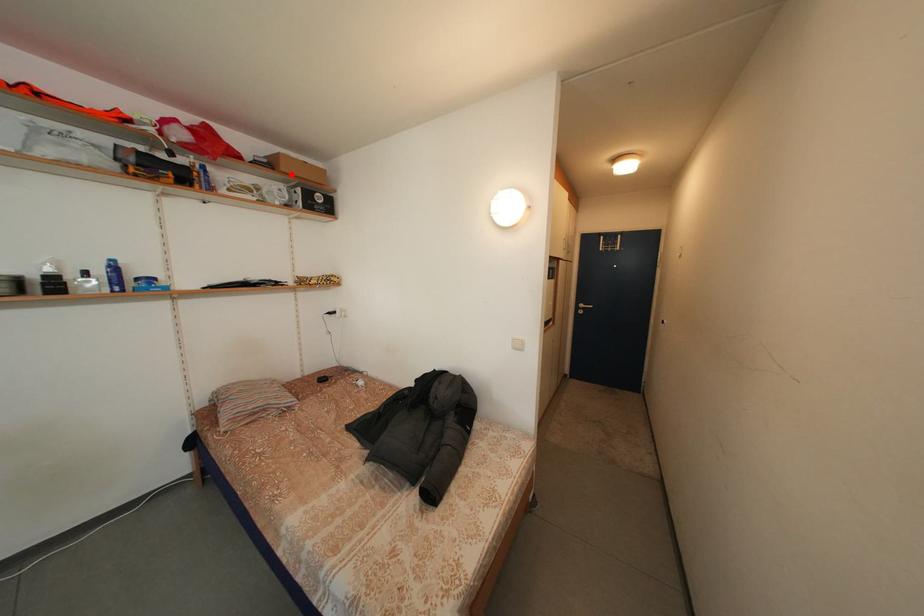
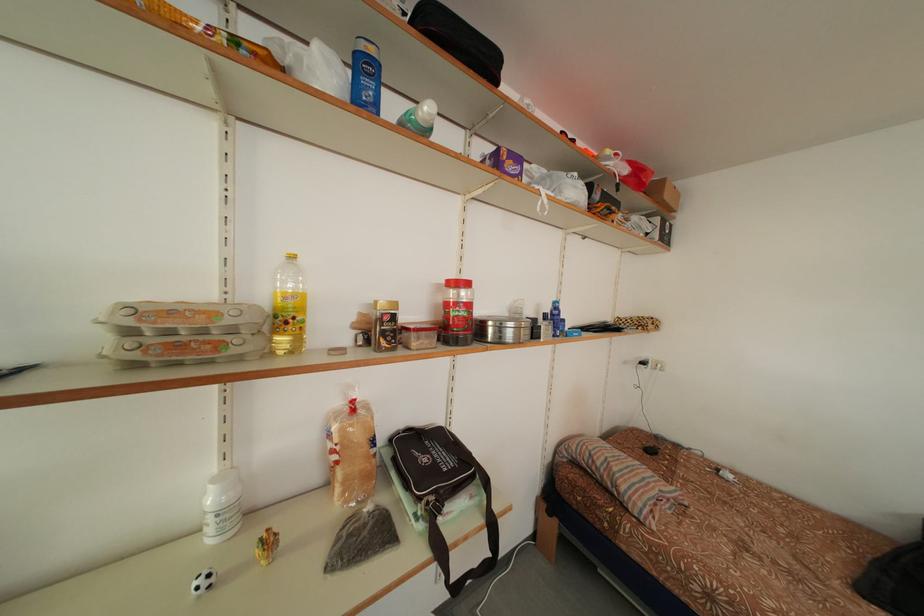
Find the pixel in the second image that matches the highlighted location in the first image.

(675, 201)